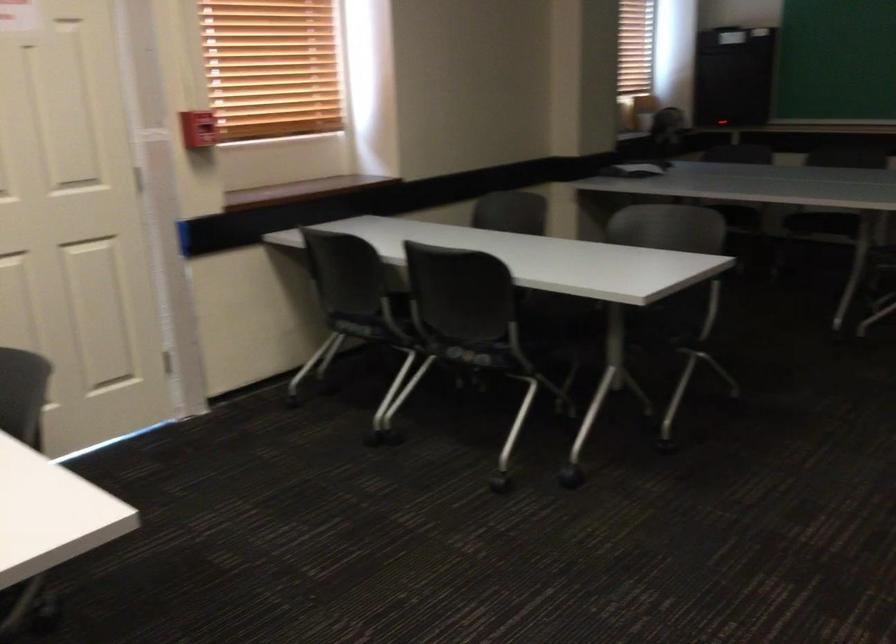
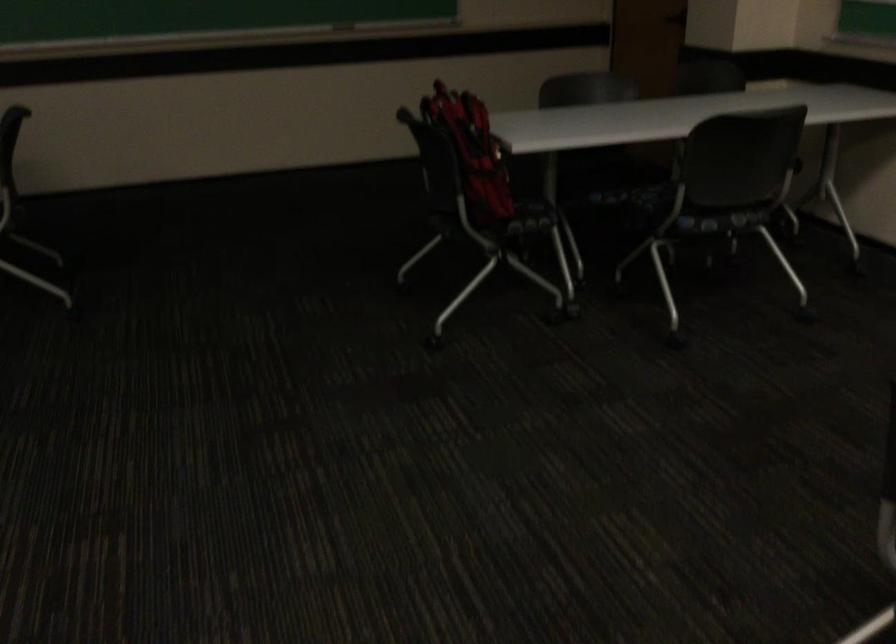
Question: The camera is either moving clockwise (left) or counter-clockwise (right) around the object. The first image is from the beginning of the video and the second image is from the end. Is the camera moving left or right when shooting the video?

Choices:
 (A) Left
 (B) Right

Answer: (A)